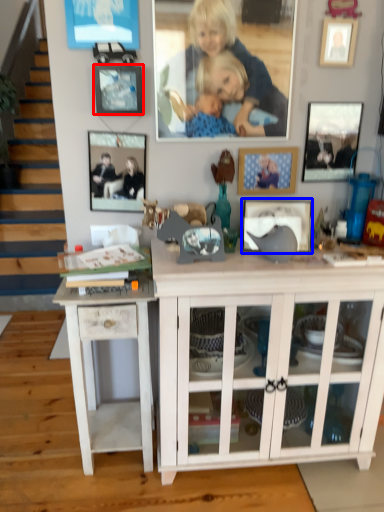
Question: Among these objects, which one is nearest to the camera, picture frame (highlighted by a red box) or picture frame (highlighted by a blue box)?

Choices:
 (A) picture frame
 (B) picture frame

Answer: (A)